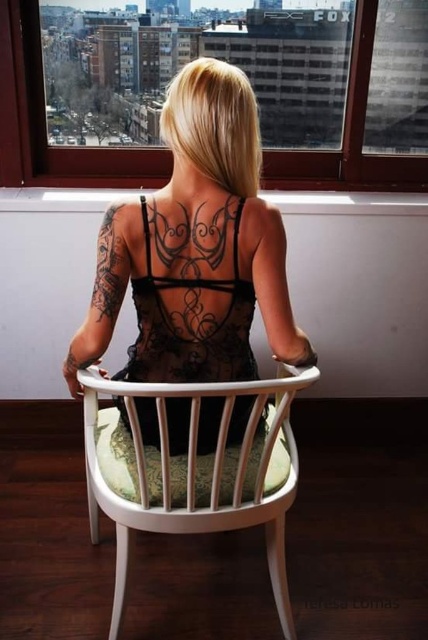
You are a fashion designer observing a model wearing the black lace dress at center and the black ink tattoo at center back. You need to determine if the tattoo will be visible through the fabric. Based on the size comparison between the two, can you conclude anything about the visibility?

The black lace dress at center is larger in size than the black ink tattoo at center back. Since the dress is larger, it may cover more of the tattoo, potentially reducing its visibility. However, the exact visibility would depend on the specific placement and coverage of the dress fabric over the tattoo area.

You are a photographer wanting to capture the white wood chair at center and the black lace dress at center in a single frame. Based on their sizes, which object should you focus on first to ensure both are in the frame?

The white wood chair at center is much taller than the black lace dress at center, so you should focus on the white wood chair at center first to ensure both are in the frame.